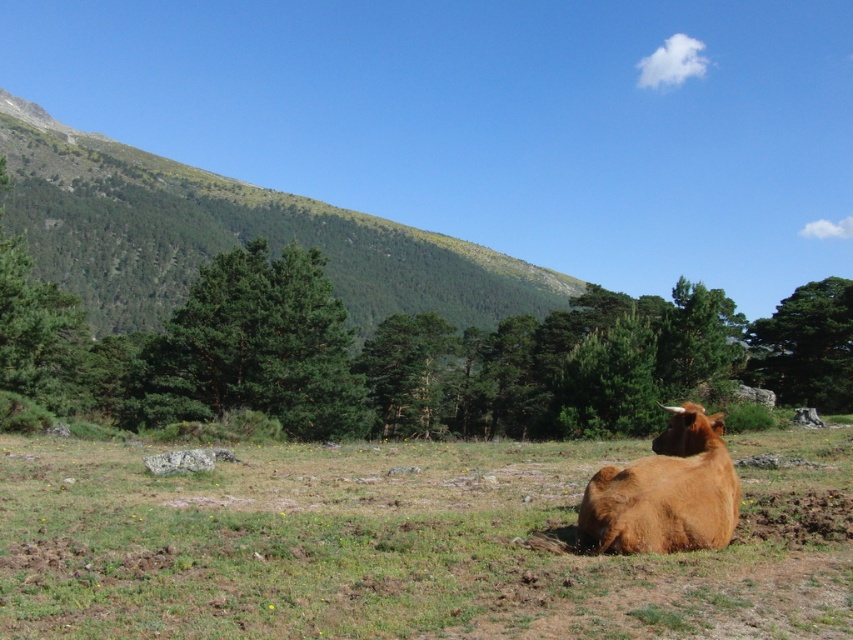
Question: Is brown grassy field at center to the left of brown furry bull at lower right from the viewer's perspective?

Choices:
 (A) yes
 (B) no

Answer: (A)

Question: Can you confirm if brown grassy field at center is smaller than brown furry bull at lower right?

Choices:
 (A) no
 (B) yes

Answer: (A)

Question: Is green grassy hillside at upper left positioned behind brown furry bull at lower right?

Choices:
 (A) no
 (B) yes

Answer: (B)

Question: Which point is closer to the camera?

Choices:
 (A) green grassy hillside at upper left
 (B) brown grassy field at center
 (C) brown furry bull at lower right

Answer: (B)

Question: Which point is closer to the camera taking this photo?

Choices:
 (A) (189, 524)
 (B) (227, 180)
 (C) (616, 490)

Answer: (C)

Question: Among these objects, which one is nearest to the camera?

Choices:
 (A) green grassy hillside at upper left
 (B) brown grassy field at center

Answer: (B)